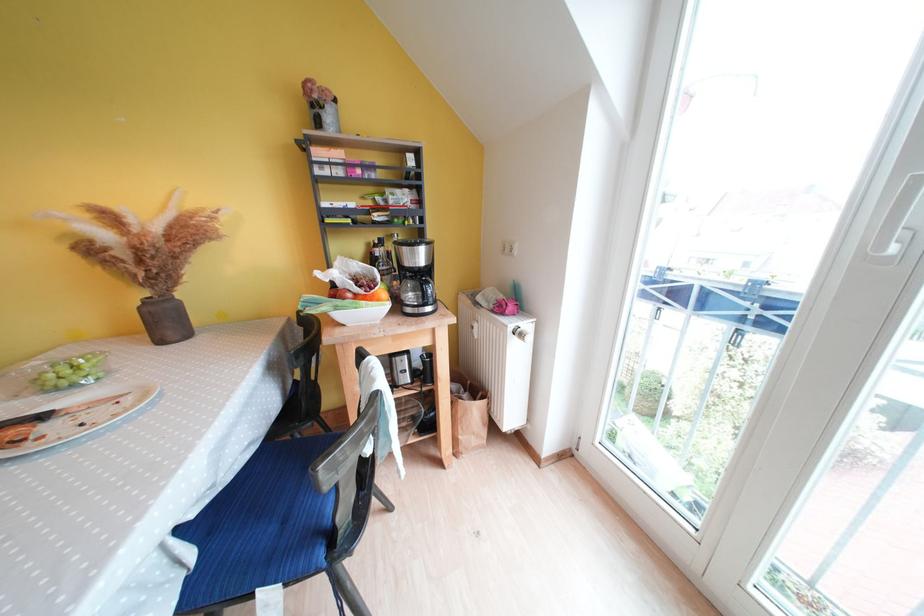
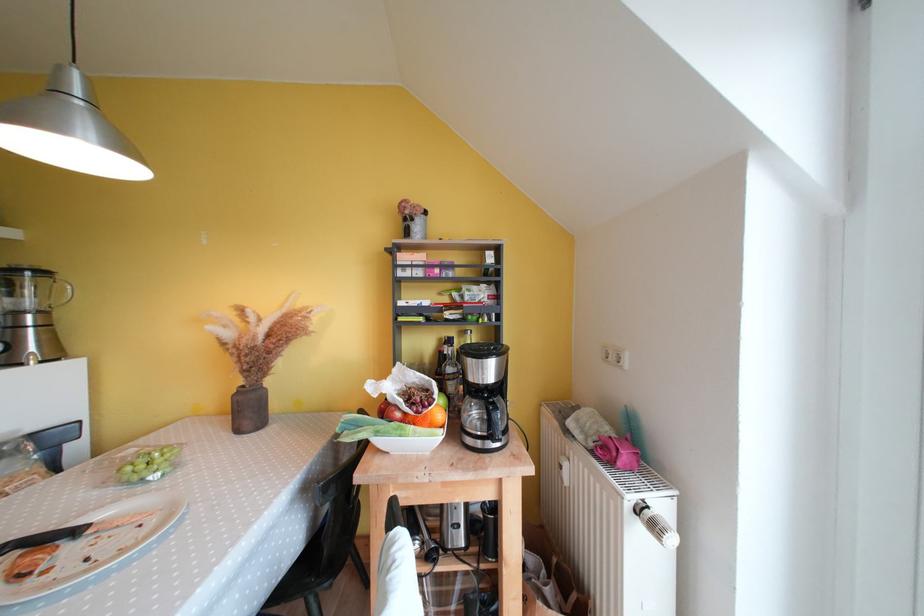
The point at [388,249] is marked in the first image. Where is the corresponding point in the second image?

(457, 350)